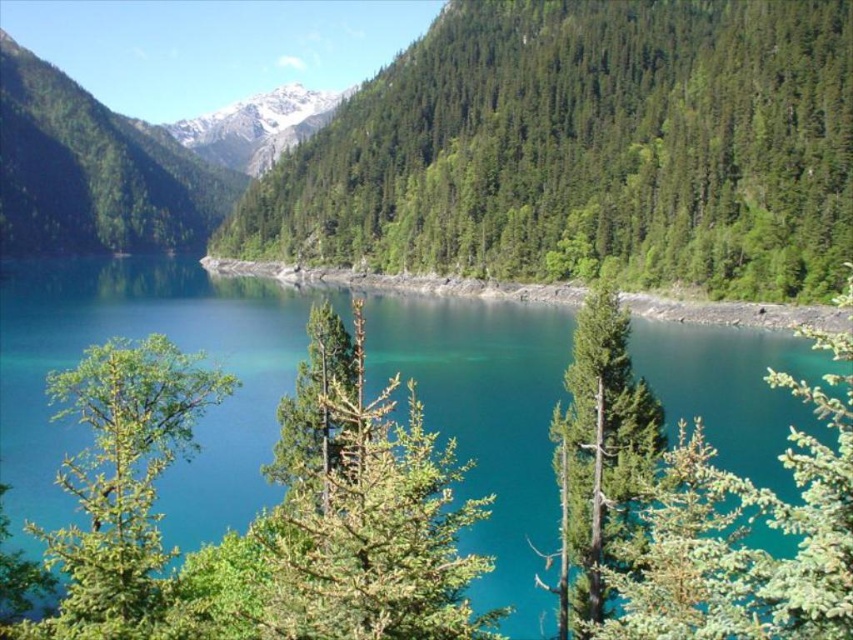
You are planning to take a photo of the green matte tree at left and the green matte tree at center from a distance. Which tree would appear wider in the photo?

The green matte tree at left appears wider in the photo because its actual width surpasses that of the green matte tree at center.

You are standing at the edge of the lake and see two points marked in the image. Which point is closer to you? The points are labeled as point (490,531) and point (432,552).

Point (490,531) is further to the camera than point (432,552), so point (432,552) is closer to you.